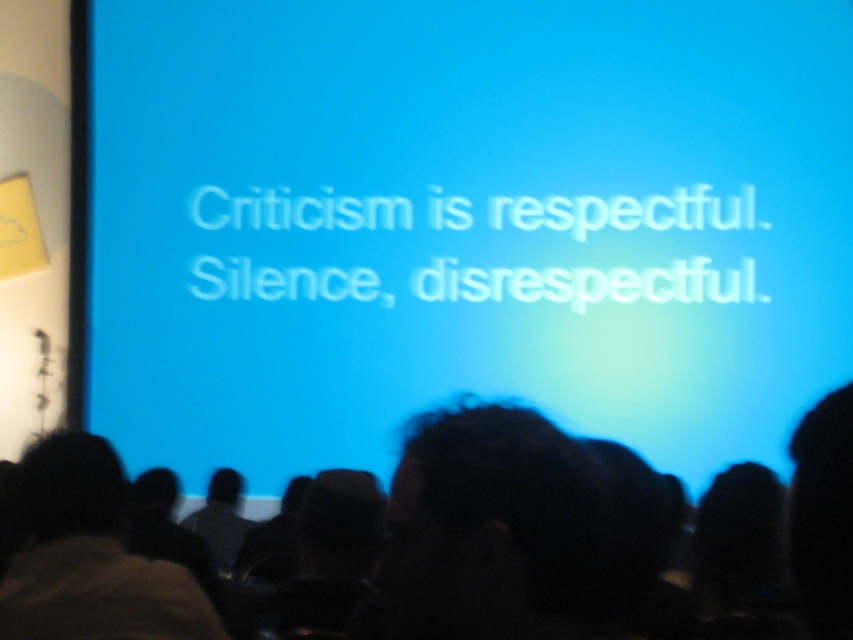
Question: Which point is farther from the camera taking this photo?

Choices:
 (A) (840, 637)
 (B) (302, 131)
 (C) (9, 627)

Answer: (B)

Question: Does blue matte screen at center appear under dark hair at center?

Choices:
 (A) no
 (B) yes

Answer: (A)

Question: Considering the relative positions of blue matte screen at center and dark hair at center in the image provided, where is blue matte screen at center located with respect to dark hair at center?

Choices:
 (A) right
 (B) left

Answer: (B)

Question: Which is nearer to the dark hair at lower left?

Choices:
 (A) blue matte screen at center
 (B) dark hair at center

Answer: (B)

Question: In this image, where is dark hair at center located relative to dark hair at lower left?

Choices:
 (A) right
 (B) left

Answer: (A)

Question: Considering the real-world distances, which object is farthest from the dark hair at lower left?

Choices:
 (A) blue matte screen at center
 (B) dark hair at center

Answer: (A)